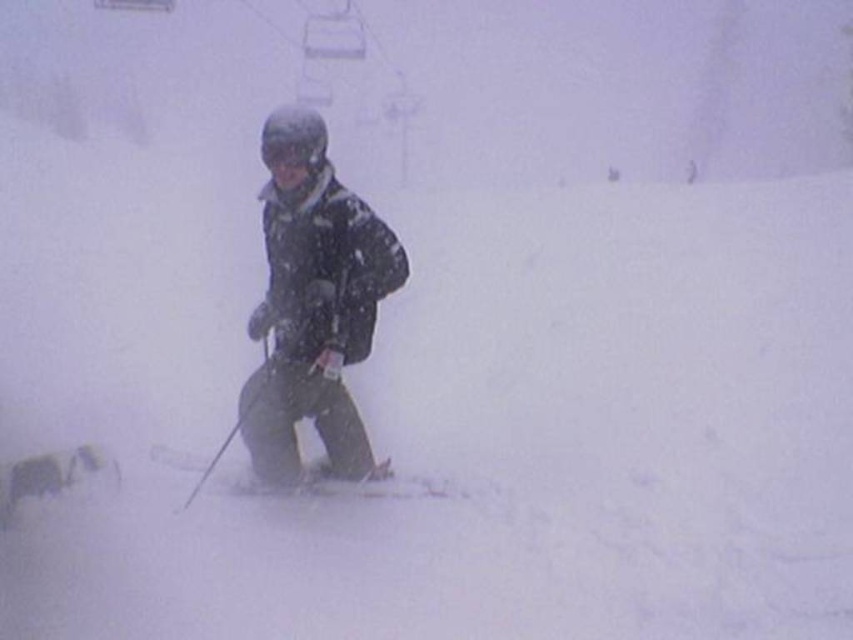
You are a skier trying to navigate through the foggy ski resort. You see two points marked in the scene. Which point is closer to you, point (332, 490) or point (315, 160)?

Point (332, 490) is closer to you because it is further to the viewer than point (315, 160).

You are a winter sports instructor assessing the equipment of a student. The student has a matte black ski at center and matte black goggles at center. Which piece of equipment is wider?

The matte black ski at center is wider than the matte black goggles at center.

You are a skier who just took off their goggles. You want to put them back on but can only see the matte black ski at center and the matte black goggles at center. Which object is closer to your face?

The matte black goggles at center are closer to your face because they are positioned above the matte black ski at center.